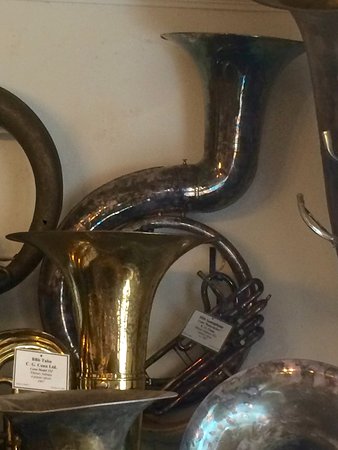
I want to click on off-white wall, so click(139, 97).